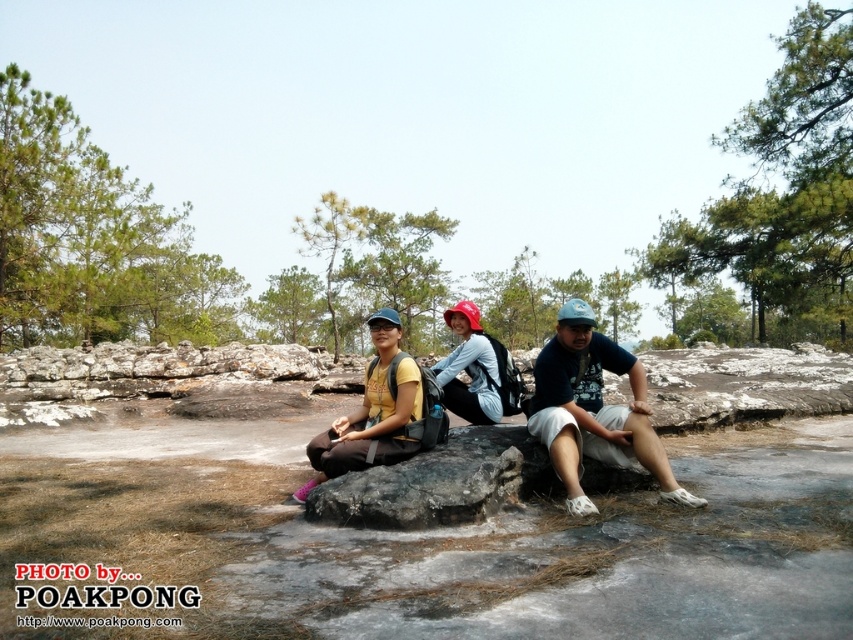
Does blue fabric shirt at center appear on the right side of gray rough boulder at center?

Yes, blue fabric shirt at center is to the right of gray rough boulder at center.

Can you confirm if blue fabric shirt at center is thinner than gray rough boulder at center?

Yes, blue fabric shirt at center is thinner than gray rough boulder at center.

Between point (544, 442) and point (390, 513), which one is positioned in front?

Positioned in front is point (390, 513).

The image size is (853, 640). In order to click on blue fabric shirt at center in this screenshot , I will do `click(593, 410)`.

Does blue fabric shirt at center have a lesser width compared to light blue fabric at center?

Incorrect, blue fabric shirt at center's width is not less than light blue fabric at center's.

Does blue fabric shirt at center appear on the left side of light blue fabric at center?

In fact, blue fabric shirt at center is to the right of light blue fabric at center.

Who is more forward, (596, 413) or (440, 374)?

Point (596, 413) is in front.

The width and height of the screenshot is (853, 640). I want to click on blue fabric shirt at center, so click(x=593, y=410).

Consider the image. Does matte yellow shirt at center have a lesser height compared to light blue fabric at center?

No.

Does matte yellow shirt at center appear over light blue fabric at center?

Incorrect, matte yellow shirt at center is not positioned above light blue fabric at center.

Is point (393, 408) behind point (457, 324)?

No, it is in front of (457, 324).

Locate an element on the screen. The width and height of the screenshot is (853, 640). matte yellow shirt at center is located at coordinates (370, 413).